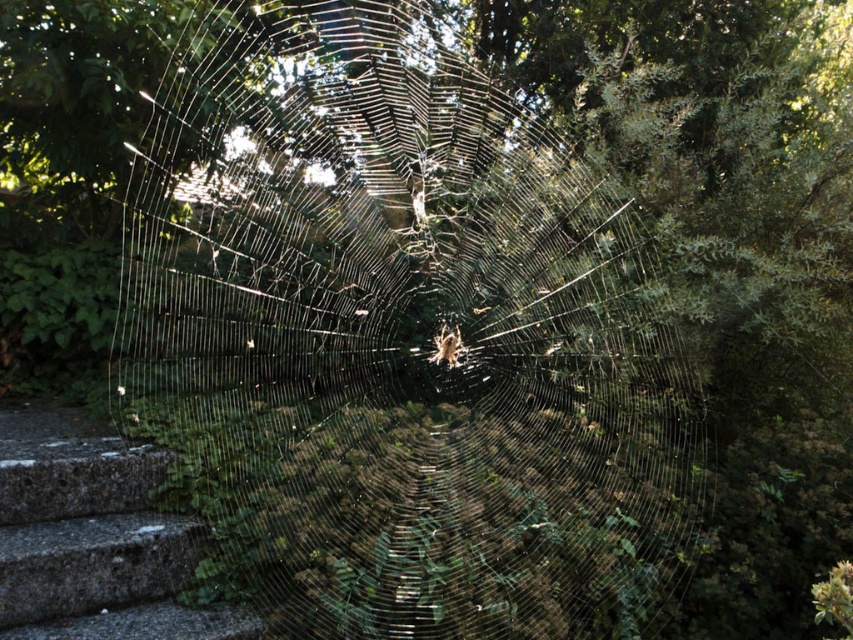
Is the position of gray concrete stairs at lower left less distant than that of brown fuzzy spider at center?

Yes, it is in front of brown fuzzy spider at center.

Who is more distant from viewer, (184, 528) or (439, 337)?

Positioned behind is point (439, 337).

Where is `gray concrete stairs at lower left`? Image resolution: width=853 pixels, height=640 pixels. gray concrete stairs at lower left is located at coordinates (91, 538).

Locate an element on the screen. The height and width of the screenshot is (640, 853). transparent silk spider web at center is located at coordinates (397, 339).

Who is more distant from viewer, (242,173) or (172,609)?

Positioned behind is point (242,173).

This screenshot has width=853, height=640. Find the location of `transparent silk spider web at center`. transparent silk spider web at center is located at coordinates (397, 339).

Does transparent silk spider web at center appear on the right side of brown fuzzy spider at center?

Incorrect, transparent silk spider web at center is not on the right side of brown fuzzy spider at center.

How much distance is there between transparent silk spider web at center and brown fuzzy spider at center?

They are 37.82 inches apart.

You are a GUI agent. You are given a task and a screenshot of the screen. Output one action in this format:
    pyautogui.click(x=<x>, y=<y>)
    Task: Click on the transparent silk spider web at center
    
    Given the screenshot: What is the action you would take?
    pyautogui.click(x=397, y=339)

Find the location of a particular element. Image resolution: width=853 pixels, height=640 pixels. transparent silk spider web at center is located at coordinates (397, 339).